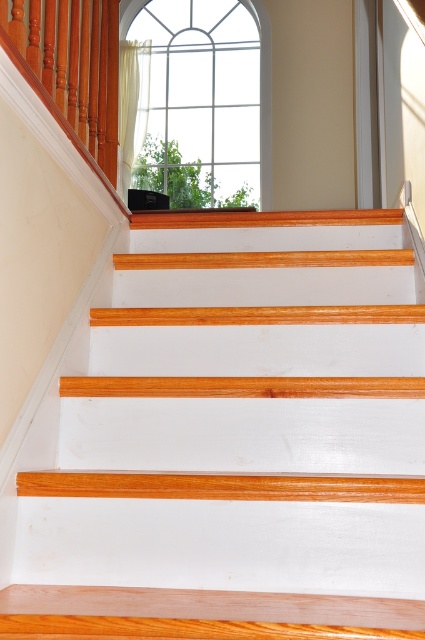
Does clear glass window at upper center have a greater height compared to polished wood handrail at upper left?

Yes, clear glass window at upper center is taller than polished wood handrail at upper left.

Is point (192, 90) positioned in front of point (108, 112)?

No, (192, 90) is further to viewer.

This screenshot has width=425, height=640. Describe the element at coordinates (201, 100) in the screenshot. I see `clear glass window at upper center` at that location.

The image size is (425, 640). Find the location of `clear glass window at upper center`. clear glass window at upper center is located at coordinates (201, 100).

Which is more to the right, white painted wood stair at center or polished wood handrail at upper left?

Positioned to the right is white painted wood stair at center.

Locate an element on the screen. white painted wood stair at center is located at coordinates (234, 442).

In the scene shown: Who is more forward, (218, 392) or (54, 92)?

Point (218, 392) is more forward.

Locate an element on the screen. The height and width of the screenshot is (640, 425). white painted wood stair at center is located at coordinates (234, 442).

Which is behind, point (402, 266) or point (127, 28)?

Point (127, 28)

Which is above, white painted wood stair at center or clear glass window at upper center?

clear glass window at upper center

Which is behind, point (312, 321) or point (155, 56)?

The point (155, 56) is behind.

This screenshot has width=425, height=640. I want to click on white painted wood stair at center, so click(x=234, y=442).